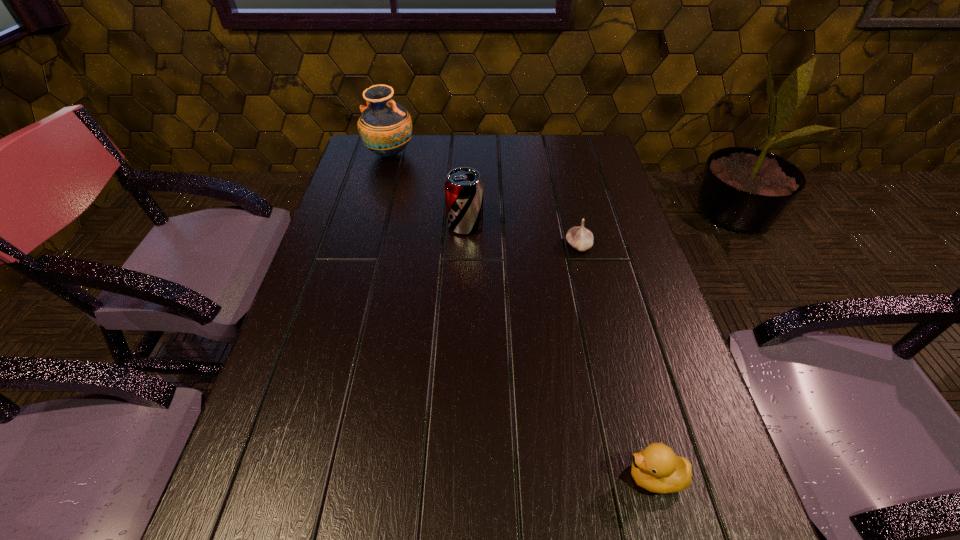
What are the coordinates of `the tallest object` in the screenshot? It's located at (385, 126).

I want to click on the leftmost object, so click(385, 126).

Locate an element on the screen. the third shortest object is located at coordinates (464, 187).

What are the coordinates of `soda can` in the screenshot? It's located at (464, 187).

Identify the location of duckling. (657, 468).

At what (x,y) coordinates should I click in order to perform the action: click on garlic. Please return your answer as a coordinate pair (x, y). Image resolution: width=960 pixels, height=540 pixels. Looking at the image, I should click on (580, 238).

The height and width of the screenshot is (540, 960). Identify the location of free space located on the front of the farthest object. (363, 253).

The image size is (960, 540). I want to click on vacant region located 0.240m on the left of the third shortest object, so click(359, 225).

Locate an element on the screen. The image size is (960, 540). free space located facing forward on the nearest object is located at coordinates (582, 477).

Locate an element on the screen. This screenshot has height=540, width=960. vacant space located facing forward on the nearest object is located at coordinates (527, 477).